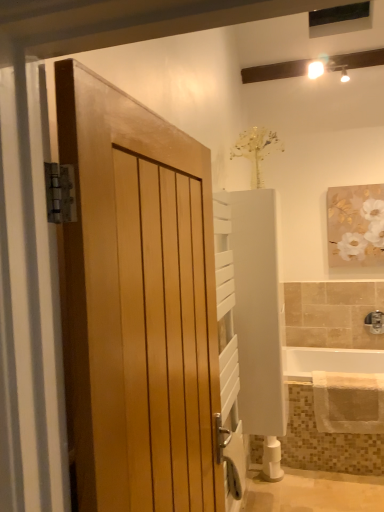
Question: From the image's perspective, is white matte toilet paper at lower center beneath white glossy bathtub at lower right?

Choices:
 (A) no
 (B) yes

Answer: (B)

Question: Is white matte toilet paper at lower center closer to camera compared to white glossy bathtub at lower right?

Choices:
 (A) yes
 (B) no

Answer: (B)

Question: From a real-world perspective, does white matte toilet paper at lower center sit lower than white glossy bathtub at lower right?

Choices:
 (A) yes
 (B) no

Answer: (A)

Question: Can you confirm if white matte toilet paper at lower center is smaller than white glossy bathtub at lower right?

Choices:
 (A) no
 (B) yes

Answer: (B)

Question: Can white glossy bathtub at lower right be found inside white matte toilet paper at lower center?

Choices:
 (A) yes
 (B) no

Answer: (B)

Question: Considering the relative sizes of white matte toilet paper at lower center and white glossy bathtub at lower right in the image provided, is white matte toilet paper at lower center wider than white glossy bathtub at lower right?

Choices:
 (A) yes
 (B) no

Answer: (B)

Question: From a real-world perspective, does white glossy bathtub at lower right stand above natural wood door at left?

Choices:
 (A) yes
 (B) no

Answer: (B)

Question: From the image's perspective, is white glossy bathtub at lower right located beneath natural wood door at left?

Choices:
 (A) no
 (B) yes

Answer: (B)

Question: From the image's perspective, is white glossy bathtub at lower right over natural wood door at left?

Choices:
 (A) no
 (B) yes

Answer: (A)

Question: Is the position of white glossy bathtub at lower right less distant than that of natural wood door at left?

Choices:
 (A) no
 (B) yes

Answer: (A)

Question: Is white glossy bathtub at lower right positioned far away from natural wood door at left?

Choices:
 (A) yes
 (B) no

Answer: (A)

Question: Can you confirm if white glossy bathtub at lower right is wider than natural wood door at left?

Choices:
 (A) no
 (B) yes

Answer: (B)

Question: Is satin nickel faucet at lower right outside white matte painting at upper right?

Choices:
 (A) yes
 (B) no

Answer: (A)